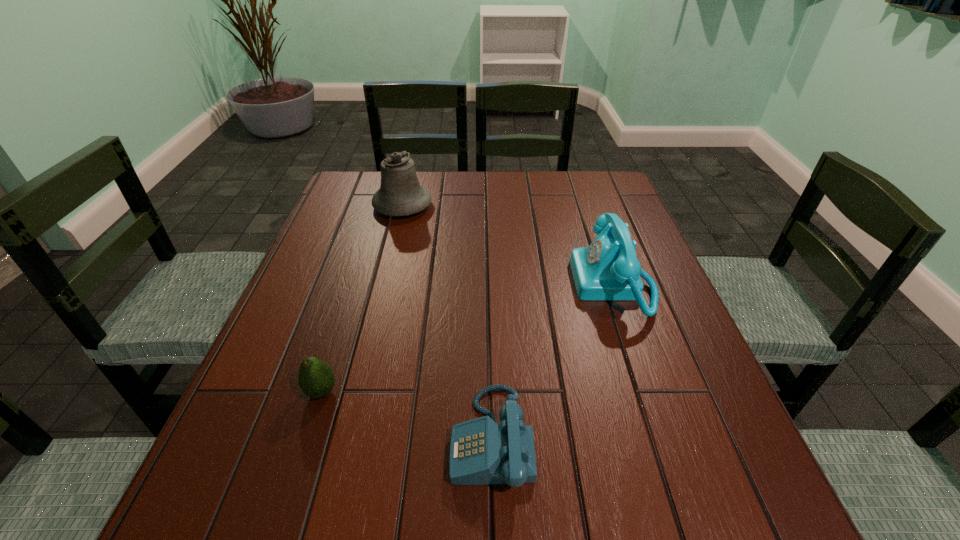
This screenshot has width=960, height=540. Find the location of `vacant point at the far edge`. vacant point at the far edge is located at coordinates [x=438, y=183].

Image resolution: width=960 pixels, height=540 pixels. In order to click on vacant point at the near edge in this screenshot , I will do `click(658, 538)`.

At what (x,y) coordinates should I click in order to perform the action: click on vacant area at the left edge of the desktop. Please return your answer as a coordinate pair (x, y). The height and width of the screenshot is (540, 960). Looking at the image, I should click on (382, 217).

This screenshot has width=960, height=540. In the image, there is a desktop. Identify the location of free region at the right edge. (717, 431).

This screenshot has height=540, width=960. Identify the location of vacant space at the far left corner. (375, 188).

The height and width of the screenshot is (540, 960). Find the location of `vacant space at the near left corner of the desktop`. vacant space at the near left corner of the desktop is located at coordinates (232, 534).

Find the location of a particular element. This screenshot has height=540, width=960. vacant region between the avocado and the shortest object is located at coordinates (407, 415).

Find the location of a particular element. This screenshot has height=540, width=960. empty space that is in between the avocado and the right telephone is located at coordinates (468, 339).

This screenshot has width=960, height=540. I want to click on vacant space in between the second object from right to left and the avocado, so click(x=407, y=415).

Locate an element on the screen. The height and width of the screenshot is (540, 960). free area in between the right telephone and the shorter telephone is located at coordinates (553, 361).